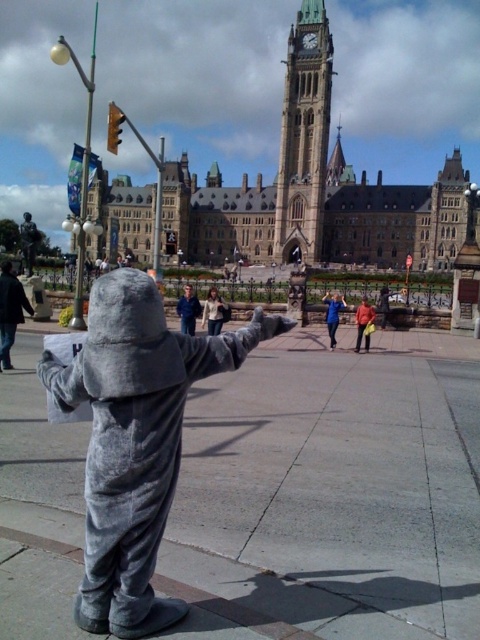
Who is lower down, blue denim jacket at center or matte gray costume at center?

blue denim jacket at center is lower down.

Does blue denim jacket at center have a lesser width compared to matte gray costume at center?

No.

Which is behind, point (194, 321) or point (385, 289)?

Point (194, 321)

This screenshot has width=480, height=640. Identify the location of blue denim jacket at center. (188, 310).

Which is in front, point (324, 298) or point (380, 291)?

Point (380, 291)

From the picture: Between blue fabric person at center and matte gray costume at center, which one is positioned lower?

Answer: blue fabric person at center

You are a GUI agent. You are given a task and a screenshot of the screen. Output one action in this format:
    pyautogui.click(x=<x>, y=<y>)
    Task: Click on the blue fabric person at center
    
    Given the screenshot: What is the action you would take?
    pyautogui.click(x=333, y=314)

The image size is (480, 640). Find the location of `blue denim jacket at center`. blue denim jacket at center is located at coordinates (188, 310).

Does point (183, 316) lie behind point (326, 310)?

No, (183, 316) is closer to viewer.

What do you see at coordinates (188, 310) in the screenshot?
I see `blue denim jacket at center` at bounding box center [188, 310].

At what (x,y) coordinates should I click in order to perform the action: click on blue denim jacket at center. Please return your answer as a coordinate pair (x, y). Image resolution: width=480 pixels, height=640 pixels. Looking at the image, I should click on (188, 310).